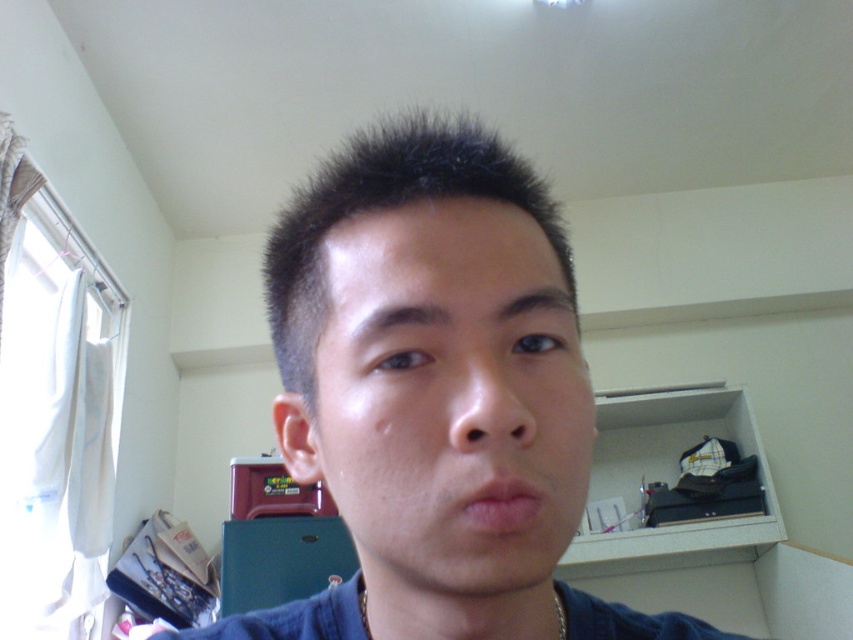
Based on the scene description, where is the blue denim shirt at center located in terms of coordinates?

The blue denim shirt at center is located at coordinates point (434, 396).

You are taking a photo of two points in the scene. The first point is labeled as point (367,499) and the second is point (300,307). Which point is closer to the camera?

Point (367,499) is closer to the camera than point (300,307).